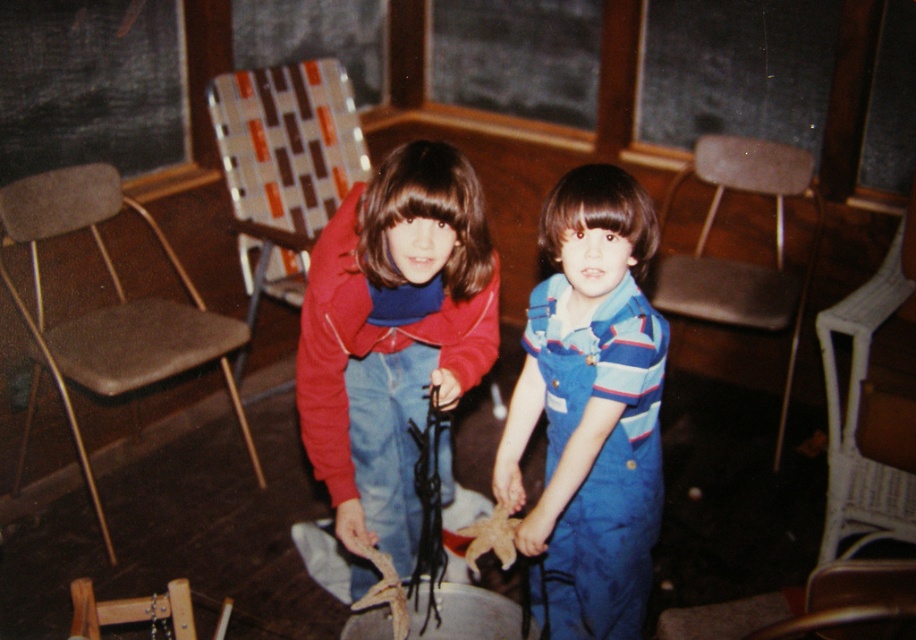
Question: Is blue denim overalls at center above patterned fabric chair at upper left?

Choices:
 (A) no
 (B) yes

Answer: (A)

Question: Among these points, which one is nearest to the camera?

Choices:
 (A) (819, 604)
 (B) (358, 173)
 (C) (435, 177)
 (D) (787, 156)

Answer: (A)

Question: Among these objects, which one is nearest to the camera?

Choices:
 (A) patterned fabric chair at upper left
 (B) brown fabric chair at lower left

Answer: (B)

Question: Can you confirm if blue denim overalls at center is bigger than patterned fabric chair at upper left?

Choices:
 (A) no
 (B) yes

Answer: (A)

Question: Does brown fabric chair at lower left appear on the left side of brown fabric chair at center?

Choices:
 (A) no
 (B) yes

Answer: (B)

Question: Among these objects, which one is farthest from the camera?

Choices:
 (A) matte red sweater at center
 (B) brown fabric chair at center

Answer: (B)